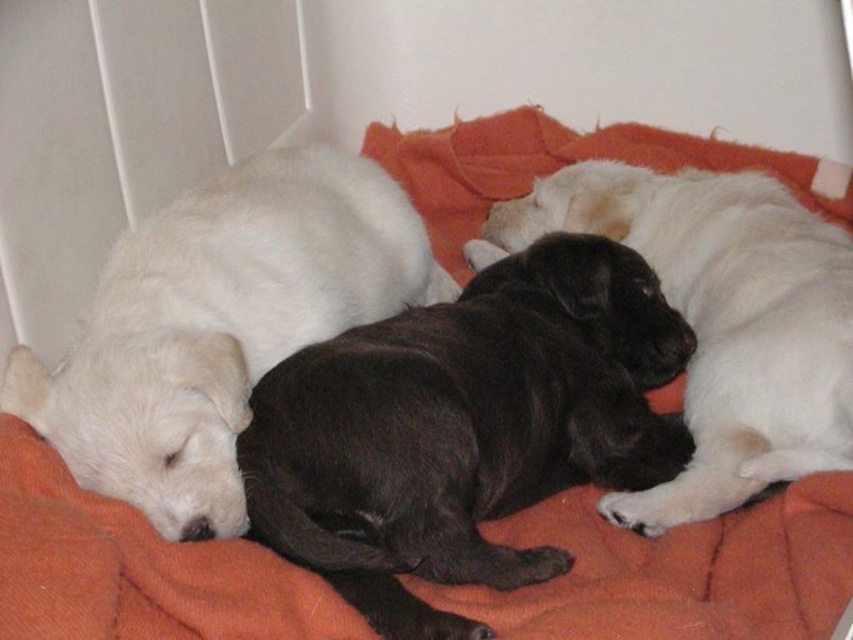
Question: From the image, what is the correct spatial relationship of white soft fur at left in relation to black smooth fur at center?

Choices:
 (A) left
 (B) right

Answer: (A)

Question: Which point is farther to the camera?

Choices:
 (A) (431, 438)
 (B) (135, 355)
 (C) (648, 216)

Answer: (C)

Question: Which of the following is the closest to the observer?

Choices:
 (A) [x=712, y=509]
 (B) [x=310, y=250]

Answer: (A)

Question: Which object is positioned farthest from the black smooth fur at center?

Choices:
 (A) black soft fur puppy at center
 (B) white soft fur at left

Answer: (B)

Question: Is black soft fur puppy at center to the right of white soft fur at left from the viewer's perspective?

Choices:
 (A) yes
 (B) no

Answer: (A)

Question: Is black soft fur puppy at center bigger than white soft fur at left?

Choices:
 (A) no
 (B) yes

Answer: (A)